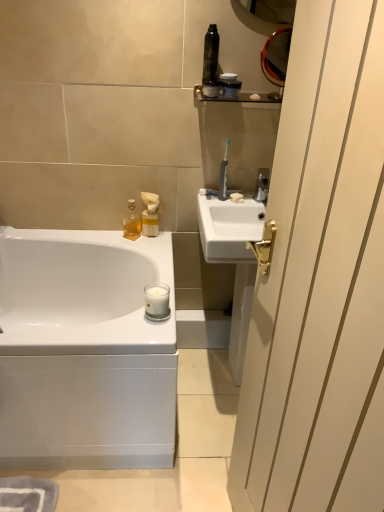
Question: Is shiny black canister at upper center, which is counted as the 2th toiletry, starting from the right, directly adjacent to white glossy screen door at right?

Choices:
 (A) yes
 (B) no

Answer: (B)

Question: From the image's perspective, is shiny black canister at upper center, placed as the first toiletry when sorted from top to bottom, on white glossy screen door at right?

Choices:
 (A) no
 (B) yes

Answer: (B)

Question: Is shiny black canister at upper center, positioned as the 1th toiletry in front-to-back order, to the left of white glossy screen door at right from the viewer's perspective?

Choices:
 (A) yes
 (B) no

Answer: (A)

Question: Does shiny black canister at upper center, which is counted as the third toiletry, starting from the bottom, turn towards white glossy screen door at right?

Choices:
 (A) no
 (B) yes

Answer: (B)

Question: Is the depth of shiny black canister at upper center, placed as the first toiletry when sorted from top to bottom, greater than that of white glossy screen door at right?

Choices:
 (A) yes
 (B) no

Answer: (A)

Question: Can we say shiny black canister at upper center, positioned as the 1th toiletry in front-to-back order, lies outside white glossy bathtub at lower left?

Choices:
 (A) no
 (B) yes

Answer: (B)

Question: Can you confirm if shiny black canister at upper center, the third toiletry from the back, is shorter than white glossy bathtub at lower left?

Choices:
 (A) yes
 (B) no

Answer: (A)

Question: Considering the relative positions of shiny black canister at upper center, which is counted as the 2th toiletry, starting from the right, and white glossy bathtub at lower left in the image provided, is shiny black canister at upper center, which is counted as the 2th toiletry, starting from the right, to the right of white glossy bathtub at lower left from the viewer's perspective?

Choices:
 (A) no
 (B) yes

Answer: (B)

Question: Does shiny black canister at upper center, which is counted as the 2th toiletry, starting from the right, appear on the left side of white glossy bathtub at lower left?

Choices:
 (A) yes
 (B) no

Answer: (B)

Question: Can you confirm if shiny black canister at upper center, the third toiletry from the back, is wider than white glossy bathtub at lower left?

Choices:
 (A) yes
 (B) no

Answer: (B)

Question: Does shiny black canister at upper center, positioned as the 1th toiletry in front-to-back order, lie behind white glossy bathtub at lower left?

Choices:
 (A) no
 (B) yes

Answer: (B)

Question: From the image's perspective, is white glossy screen door at right below metallic silver shelf at upper center?

Choices:
 (A) yes
 (B) no

Answer: (A)